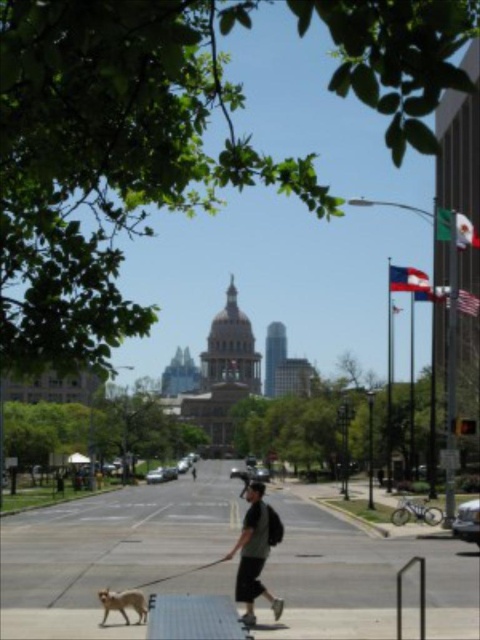
You are a delivery person who needs to place a small package on the wooden skateboard at lower center. However, there is a golden fur dog at lower left in the way. Can you move the dog to the right to make space for the package?

The golden fur dog at lower left is positioned on the left side of the wooden skateboard at lower center. Moving the dog to the right would place it closer to the skateboard, which might not create enough space. Alternatively, moving the dog further to the right away from the skateboard could allow space, but the description doesn

Consider the image. You are a delivery person who needs to place a small package on the wooden skateboard at lower center. However, there is a golden fur dog at lower left nearby. Considering their heights, can you safely place the package without the dog reaching it?

The golden fur dog at lower left is much taller than the wooden skateboard at lower center. Therefore, the dog can easily reach the package placed on the wooden skateboard at lower center, so it might not be safe.

You are a delivery person carrying a dark gray fabric backpack at center and need to walk on the smooth concrete sidewalk at center. Can you fit the backpack on the sidewalk while walking?

The smooth concrete sidewalk at center is bigger than dark gray fabric backpack at center, so yes, the backpack can fit on the sidewalk while walking.